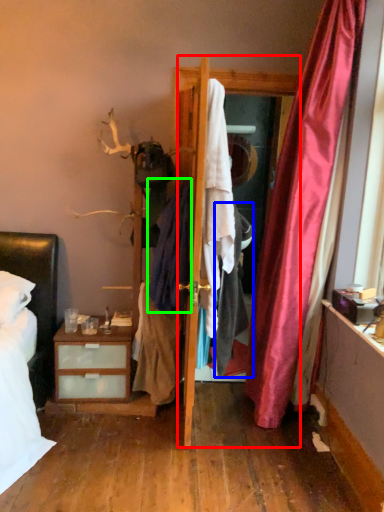
Question: Estimate the real-world distances between objects in this image. Which object is farther from screen door (highlighted by a red box), clothing (highlighted by a blue box) or clothing (highlighted by a green box)?

Choices:
 (A) clothing
 (B) clothing

Answer: (A)